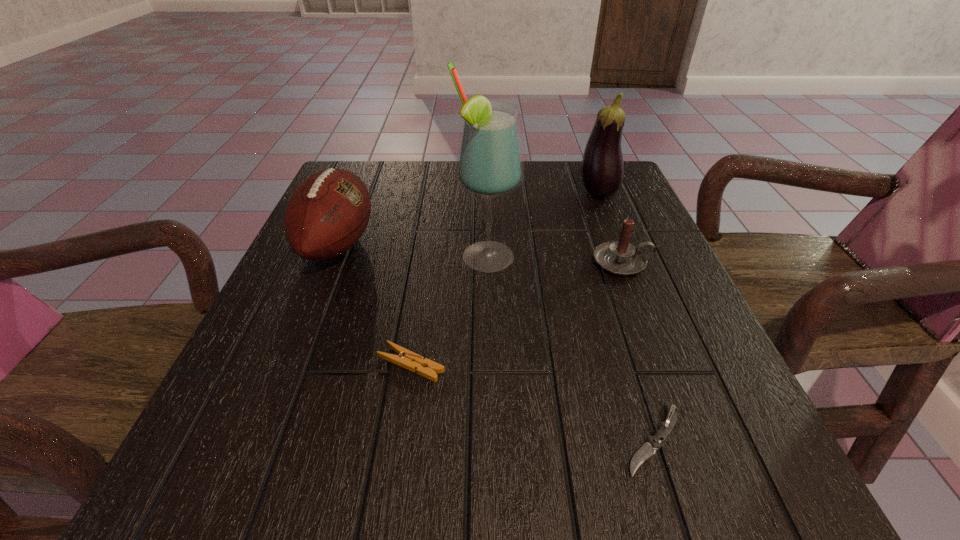
I want to click on candle that is at the right edge, so click(620, 257).

You are a GUI agent. You are given a task and a screenshot of the screen. Output one action in this format:
    pyautogui.click(x=<x>, y=<y>)
    Task: Click on the pocketknife that is at the right edge
    
    Given the screenshot: What is the action you would take?
    pyautogui.click(x=648, y=449)

Image resolution: width=960 pixels, height=540 pixels. What are the coordinates of `object that is positioned at the far right corner` in the screenshot? It's located at (602, 170).

Identify the location of object present at the near right corner. Image resolution: width=960 pixels, height=540 pixels. (648, 449).

The image size is (960, 540). I want to click on vacant space at the far edge of the desktop, so click(x=535, y=178).

In the image, there is a desktop. Where is `vacant space at the near edge`? Image resolution: width=960 pixels, height=540 pixels. vacant space at the near edge is located at coordinates (567, 518).

Identify the location of blank space at the left edge. (352, 274).

In the image, there is a desktop. At what (x,y) coordinates should I click in order to perform the action: click on vacant space at the right edge. Please return your answer as a coordinate pair (x, y). Looking at the image, I should click on (669, 438).

The height and width of the screenshot is (540, 960). Identify the location of free space at the far right corner of the desktop. (599, 202).

Where is `free point between the eggplant and the fourth object from right to left`? free point between the eggplant and the fourth object from right to left is located at coordinates (542, 226).